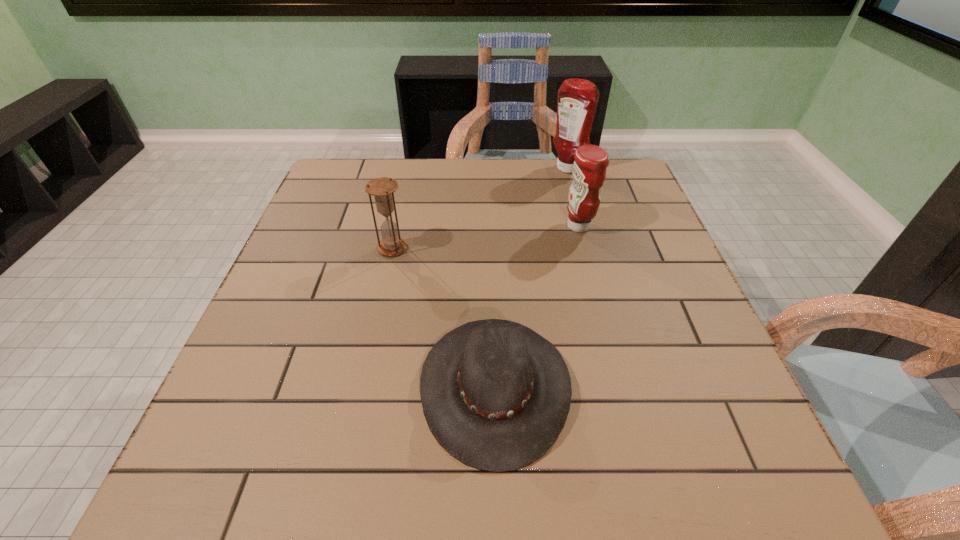
Find the location of `vacant point located between the second shortest object and the shorter condiment`. vacant point located between the second shortest object and the shorter condiment is located at coordinates (486, 237).

Identify which object is the nearest to the second object from left to right. Please provide its 2D coordinates. Your answer should be formatted as a tuple, i.e. [(x, y)], where the tuple contains the x and y coordinates of a point satisfying the conditions above.

[(383, 188)]

Find the location of a particular element. object that ranks as the third closest to the nearest object is located at coordinates click(x=577, y=98).

Where is `blank space that satisfies the following two spatial constraints: 1. on the back side of the shorter condiment; 2. on the left side of the hourglass`? blank space that satisfies the following two spatial constraints: 1. on the back side of the shorter condiment; 2. on the left side of the hourglass is located at coordinates (397, 226).

Find the location of a particular element. vacant space that satisfies the following two spatial constraints: 1. on the back side of the leftmost object; 2. on the left side of the tallest object is located at coordinates (410, 170).

In order to click on free location that satisfies the following two spatial constraints: 1. on the front side of the taller condiment; 2. on the front-facing side of the shortest object in this screenshot , I will do `click(627, 387)`.